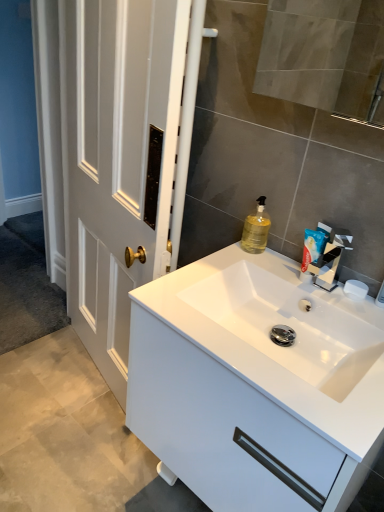
Find the location of a particular element. The image size is (384, 512). free space on the front side of white matte soap at right is located at coordinates (360, 317).